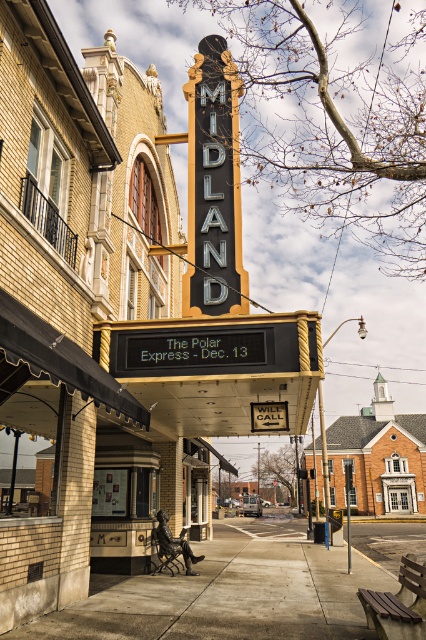
You are standing at the entrance of the Midland Theatre and want to walk towards the gray concrete sidewalk at lower center. According to the image, in which direction should you move relative to your current position?

The gray concrete sidewalk at lower center is located at point (x=241, y=588), so you should move towards the lower center direction from your current position at the entrance.

You are a delivery person trying to park your 2.5 meter wide truck near the Midland Theatre. You see the gray concrete sidewalk at lower center and the matte black sign at center. Which area can accommodate your truck without blocking the sidewalk?

The gray concrete sidewalk at lower center might be wider than matte black sign at center, so the gray concrete sidewalk at lower center can accommodate the truck without blocking the sidewalk.